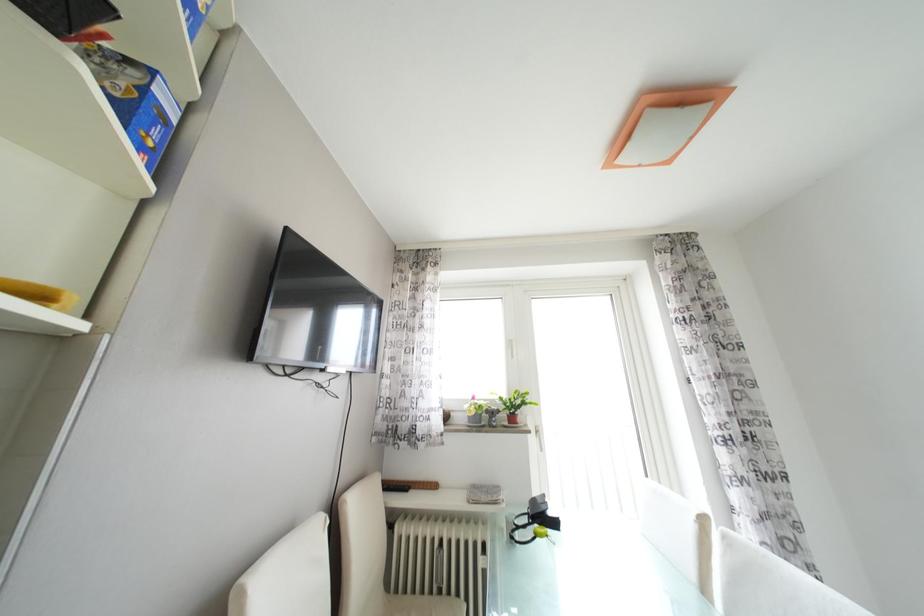
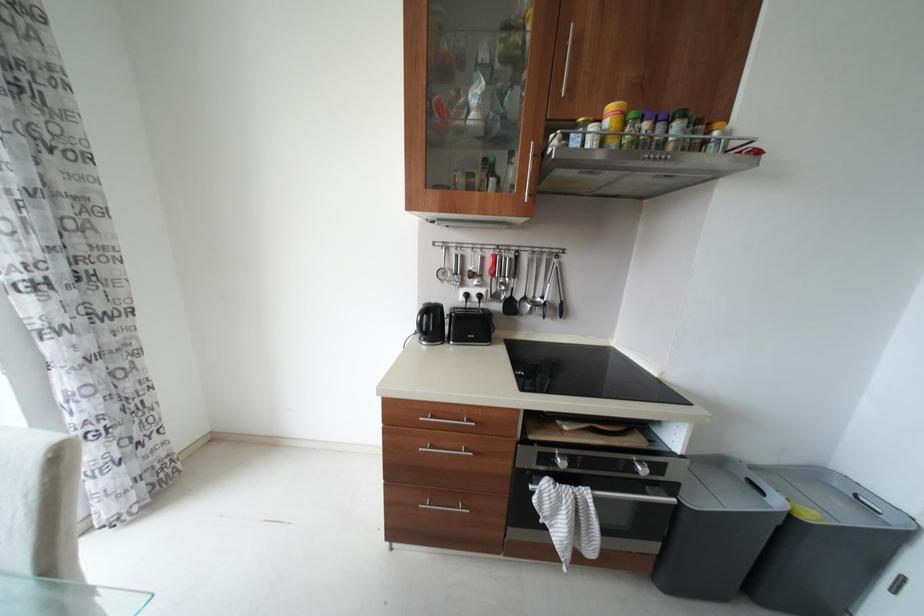
Question: The first image is from the beginning of the video and the second image is from the end. How did the camera likely rotate when shooting the video?

Choices:
 (A) Left
 (B) Right
 (C) Up
 (D) Down

Answer: (B)